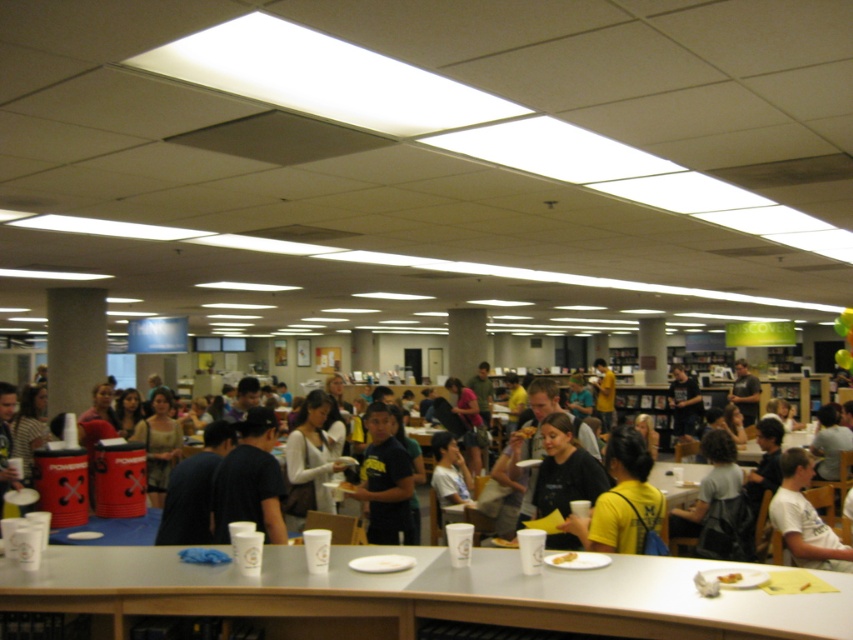
Question: Does white plastic cups at center have a smaller size compared to dark blue t-shirt at center?

Choices:
 (A) yes
 (B) no

Answer: (B)

Question: Is white plastic cups at center further to camera compared to white t-shirt at center?

Choices:
 (A) no
 (B) yes

Answer: (A)

Question: Which is nearer to the white plastic cups at center?

Choices:
 (A) dark blue t-shirt at center
 (B) white t-shirt at center

Answer: (A)

Question: Does white plastic cups at center lie behind white t-shirt at center?

Choices:
 (A) no
 (B) yes

Answer: (A)

Question: Among these objects, which one is farthest from the camera?

Choices:
 (A) white plastic cups at center
 (B) white t-shirt at center

Answer: (B)

Question: Which object appears closest to the camera in this image?

Choices:
 (A) white plastic cups at center
 (B) dark blue t-shirt at center

Answer: (A)